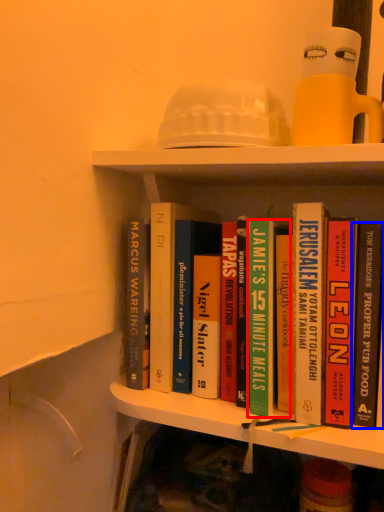
Question: Which point is further to the camera, book (highlighted by a red box) or book (highlighted by a blue box)?

Choices:
 (A) book
 (B) book

Answer: (A)